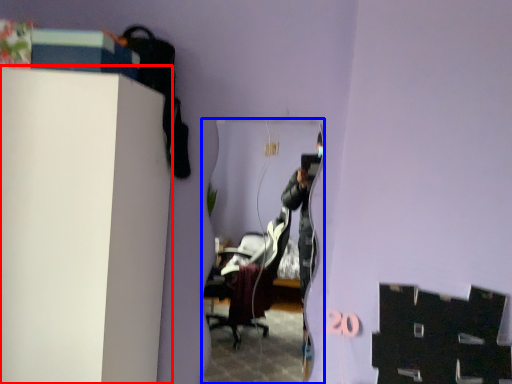
Question: Among these objects, which one is nearest to the camera, furniture (highlighted by a red box) or mirror (highlighted by a blue box)?

Choices:
 (A) furniture
 (B) mirror

Answer: (A)